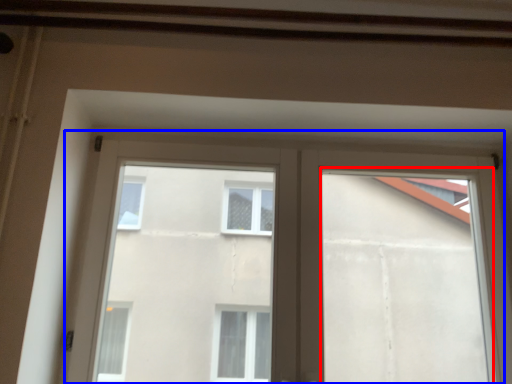
Question: Which of the following is the farthest to the observer, window frame (highlighted by a red box) or window (highlighted by a blue box)?

Choices:
 (A) window frame
 (B) window

Answer: (B)